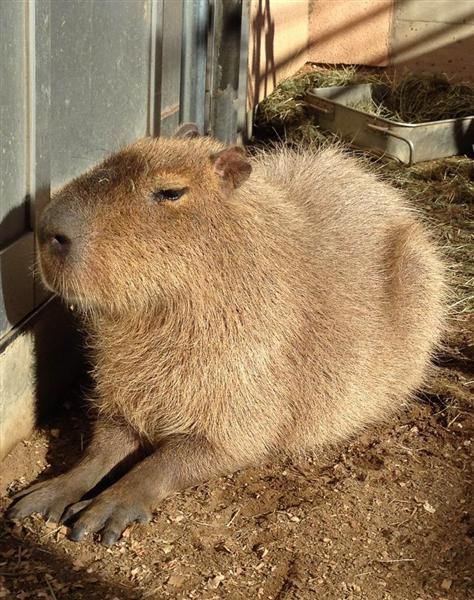
I want to click on far wall, so click(x=359, y=20).